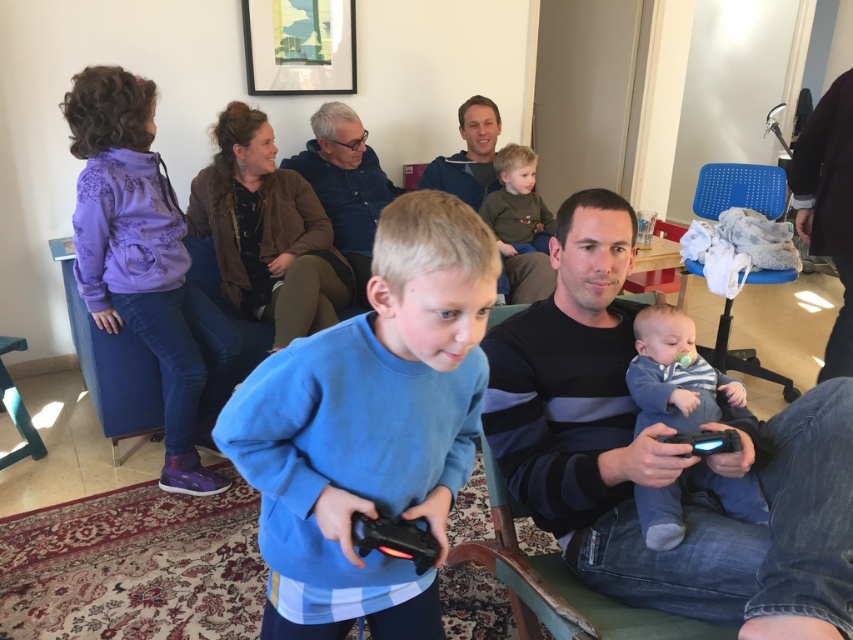
Can you confirm if brown leather jacket at upper center is positioned to the left of dark green sweater at center?

Yes, brown leather jacket at upper center is to the left of dark green sweater at center.

Looking at this image, does brown leather jacket at upper center lie behind dark green sweater at center?

Yes, brown leather jacket at upper center is behind dark green sweater at center.

Find the location of `brown leather jacket at upper center`. brown leather jacket at upper center is located at coordinates (345, 184).

Does blue fleece sweatshirt at center have a greater height compared to blue mesh chair at upper right?

Yes, blue fleece sweatshirt at center is taller than blue mesh chair at upper right.

Between blue fleece sweatshirt at center and blue mesh chair at upper right, which one appears on the right side from the viewer's perspective?

blue mesh chair at upper right is more to the right.

This screenshot has width=853, height=640. What do you see at coordinates (369, 428) in the screenshot? I see `blue fleece sweatshirt at center` at bounding box center [369, 428].

In order to click on blue fleece sweatshirt at center in this screenshot , I will do `click(369, 428)`.

Between point (654, 589) and point (488, 156), which one is positioned in front?

Point (654, 589) is more forward.

What do you see at coordinates (662, 456) in the screenshot?
I see `dark gray striped shirt at center` at bounding box center [662, 456].

Image resolution: width=853 pixels, height=640 pixels. I want to click on dark gray striped shirt at center, so click(x=662, y=456).